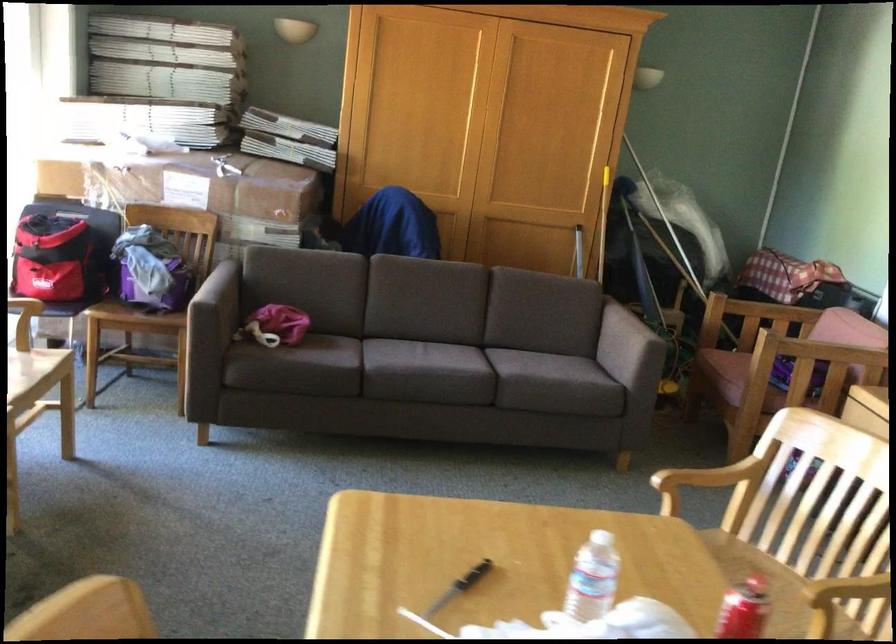
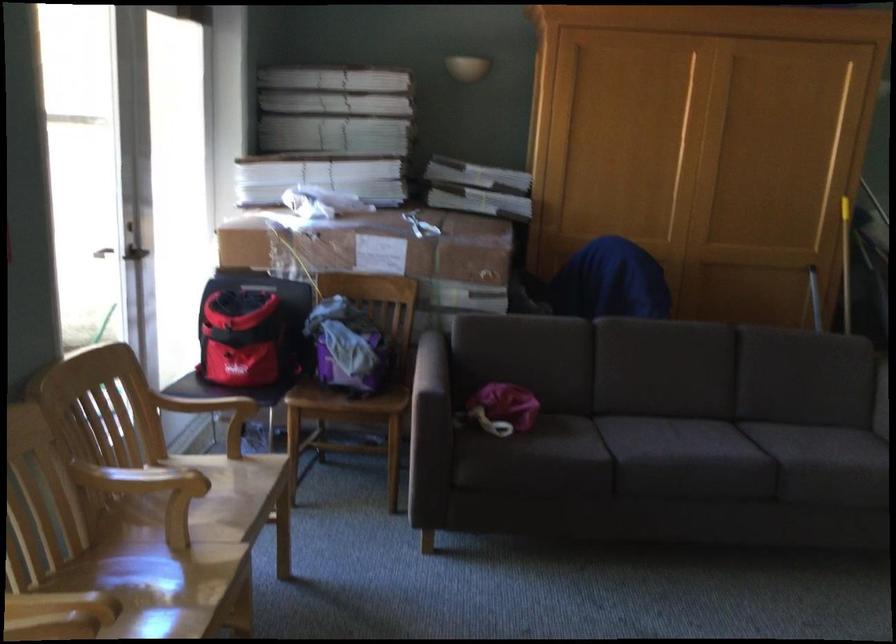
In the second image, find the point that corresponds to (x=455, y=355) in the first image.

(724, 439)